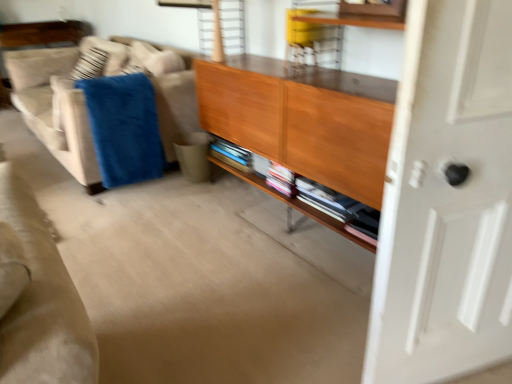
Question: Does wooden shelf at center have a lesser height compared to beige fabric couch at left?

Choices:
 (A) no
 (B) yes

Answer: (B)

Question: Is wooden shelf at center thinner than beige fabric couch at left?

Choices:
 (A) yes
 (B) no

Answer: (A)

Question: Does wooden shelf at center come behind beige fabric couch at left?

Choices:
 (A) yes
 (B) no

Answer: (B)

Question: From a real-world perspective, is wooden shelf at center positioned under beige fabric couch at left based on gravity?

Choices:
 (A) yes
 (B) no

Answer: (A)

Question: From a real-world perspective, is wooden shelf at center positioned over beige fabric couch at left based on gravity?

Choices:
 (A) no
 (B) yes

Answer: (A)

Question: Considering the positions of beige fabric couch at left and wooden cabinet at center in the image, is beige fabric couch at left taller or shorter than wooden cabinet at center?

Choices:
 (A) short
 (B) tall

Answer: (A)

Question: From a real-world perspective, relative to wooden cabinet at center, is beige fabric couch at left vertically above or below?

Choices:
 (A) below
 (B) above

Answer: (A)

Question: Visually, is beige fabric couch at left positioned to the left or to the right of wooden cabinet at center?

Choices:
 (A) right
 (B) left

Answer: (B)

Question: Is beige fabric couch at left in front of or behind wooden cabinet at center in the image?

Choices:
 (A) front
 (B) behind

Answer: (B)

Question: Looking at their shapes, would you say white glossy door at right is wider or thinner than beige fabric couch at left?

Choices:
 (A) wide
 (B) thin

Answer: (B)

Question: Is white glossy door at right inside the boundaries of beige fabric couch at left, or outside?

Choices:
 (A) outside
 (B) inside

Answer: (A)

Question: From the image's perspective, is white glossy door at right above or below beige fabric couch at left?

Choices:
 (A) below
 (B) above

Answer: (A)

Question: Visually, is white glossy door at right positioned to the left or to the right of beige fabric couch at left?

Choices:
 (A) left
 (B) right

Answer: (B)

Question: Looking at their shapes, would you say wooden shelf at center is wider or thinner than white glossy door at right?

Choices:
 (A) thin
 (B) wide

Answer: (B)

Question: Is point (231, 167) closer or farther from the camera than point (386, 294)?

Choices:
 (A) closer
 (B) farther

Answer: (B)